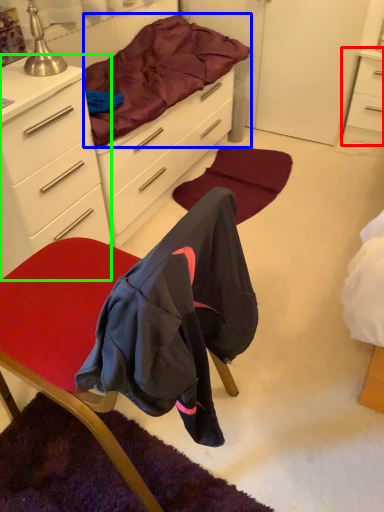
Question: Which object is the farthest from nightstand (highlighted by a red box)? Choose among these: bedding (highlighted by a blue box) or cabinetry (highlighted by a green box).

Choices:
 (A) bedding
 (B) cabinetry

Answer: (B)